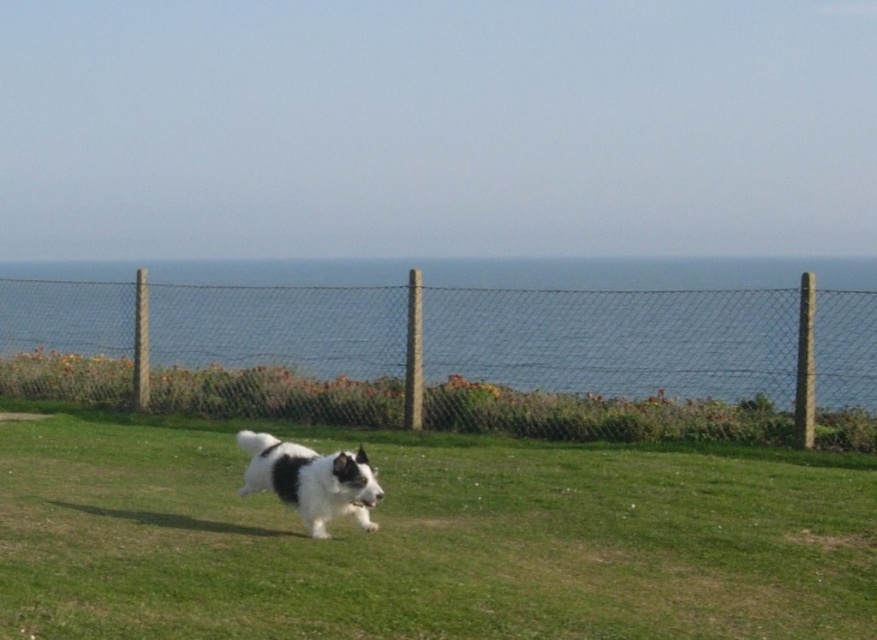
Consider the image. You are a gardener who wants to plant a row of flowers along the green grass at center and wire mesh fence at center. Considering their widths, which area can accommodate a wider row of flowers?

The wire mesh fence at center is wider than the green grass at center, so the row of flowers can be planted along the wire mesh fence at center.